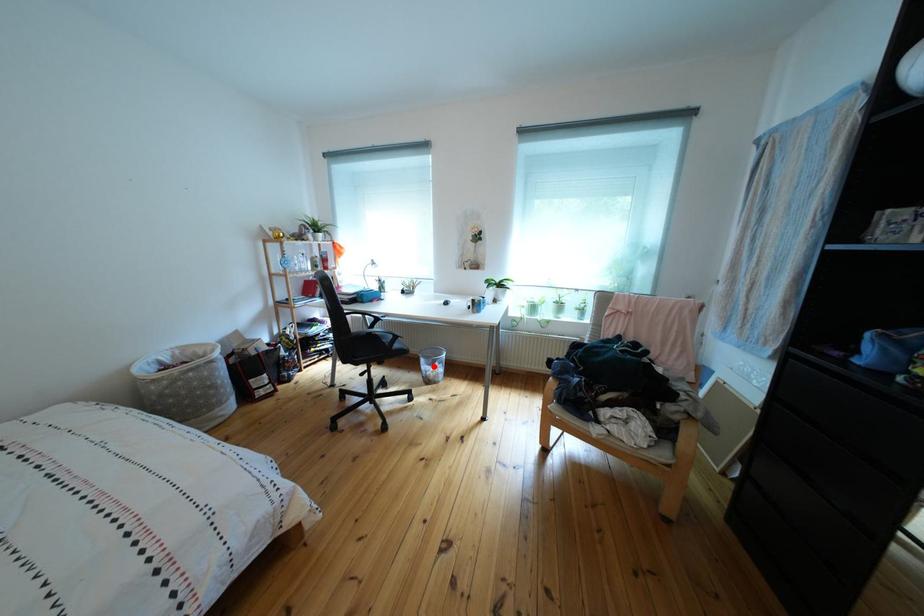
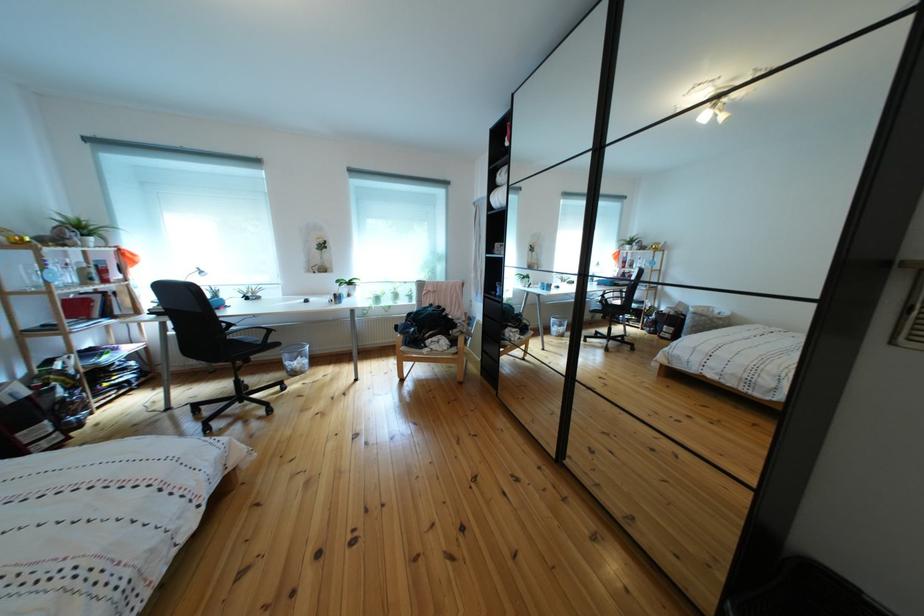
Question: I am providing you with two images of the same scene from different viewpoints. Given a red point in image1, look at the same physical point in image2. Is it:

Choices:
 (A) Closer to the viewpoint
 (B) Farther from the viewpoint

Answer: (A)